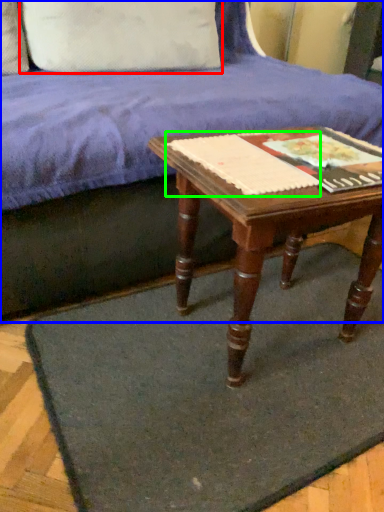
Question: Which is nearer to the pillow (highlighted by a red box)? studio couch (highlighted by a blue box) or paperback book (highlighted by a green box).

Choices:
 (A) studio couch
 (B) paperback book

Answer: (A)